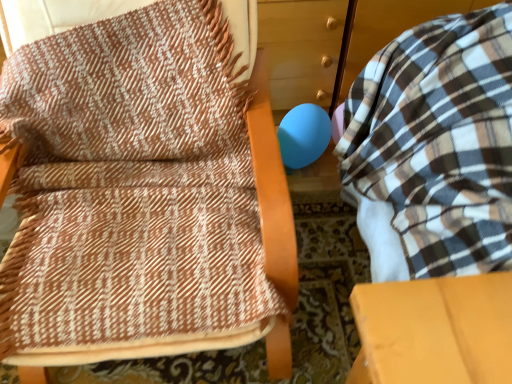
Question: Is matte blue balloon at center wider or thinner than brown woven blanket at upper left?

Choices:
 (A) thin
 (B) wide

Answer: (A)

Question: Which is correct: matte blue balloon at center is inside brown woven blanket at upper left, or outside of it?

Choices:
 (A) inside
 (B) outside

Answer: (B)

Question: Which object is positioned closest to the brown woven blanket at upper left?

Choices:
 (A) plaid fabric bean bag at right
 (B) matte blue balloon at center

Answer: (A)

Question: Which of these objects is positioned farthest from the matte blue balloon at center?

Choices:
 (A) brown woven blanket at upper left
 (B) plaid fabric bean bag at right

Answer: (A)